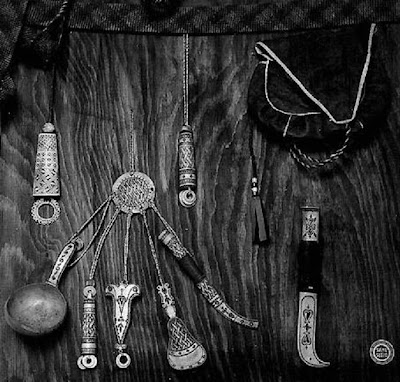
Find the location of a particular element. cords is located at coordinates (54, 74), (185, 79), (132, 137).